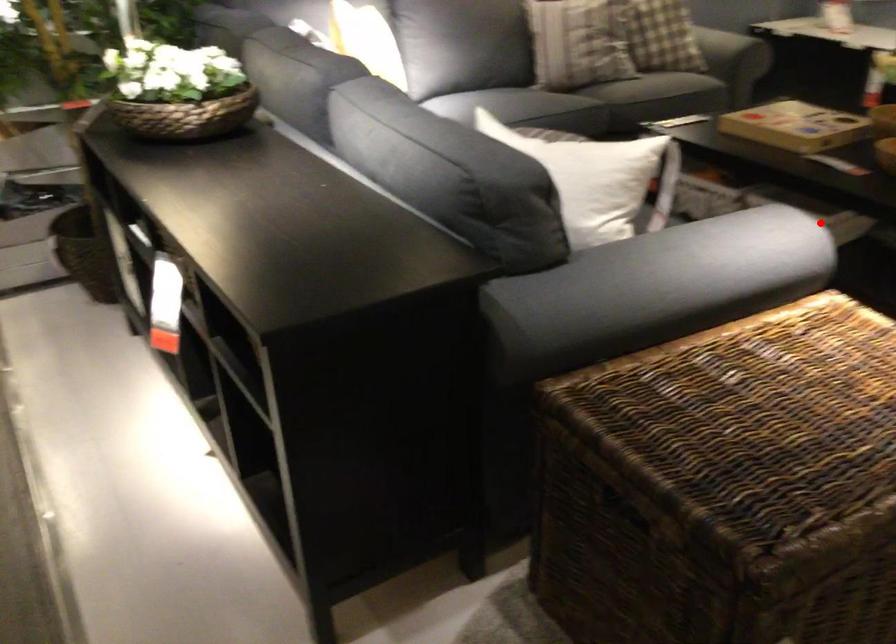
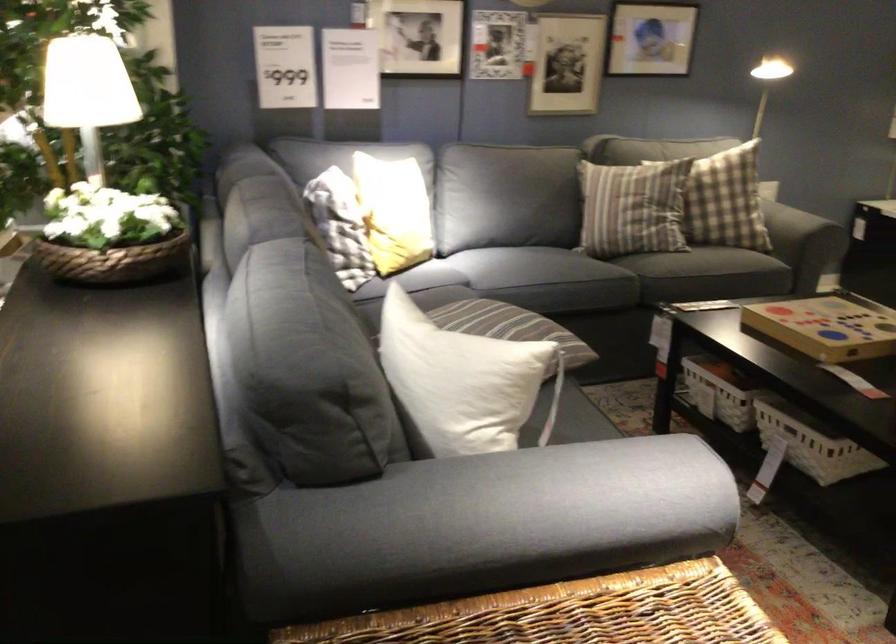
Question: I am providing you with two images of the same scene from different viewpoints. Image1 has a red point marked. In image2, the corresponding 3D location appears at what relative position? Reply with the corresponding letter.

Choices:
 (A) Closer
 (B) Farther

Answer: (A)